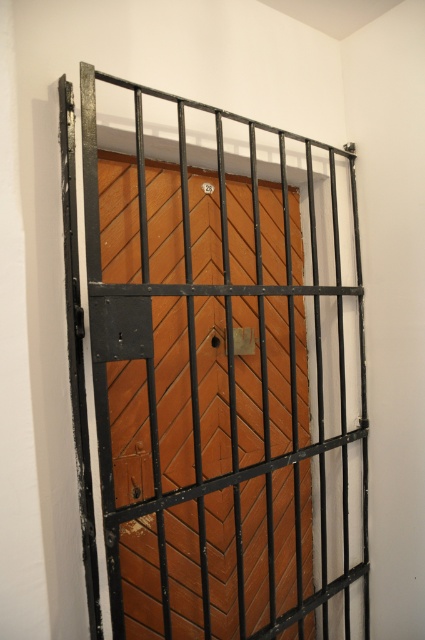
Question: Can you confirm if brown wooden door at center is positioned to the left of metallic gold lock at center?

Choices:
 (A) no
 (B) yes

Answer: (A)

Question: Which point is farther to the camera?

Choices:
 (A) brown wooden door at center
 (B) metallic gold lock at center

Answer: (B)

Question: Observing the image, what is the correct spatial positioning of brown wooden door at center in reference to metallic gold lock at center?

Choices:
 (A) left
 (B) right

Answer: (B)

Question: Is the position of brown wooden door at center less distant than that of metallic gold lock at center?

Choices:
 (A) no
 (B) yes

Answer: (B)